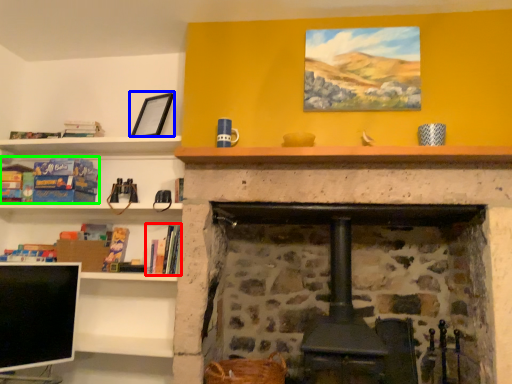
Question: Which object is positioned closest to book (highlighted by a red box)? Select from picture frame (highlighted by a blue box) and book (highlighted by a green box).

Choices:
 (A) picture frame
 (B) book

Answer: (B)